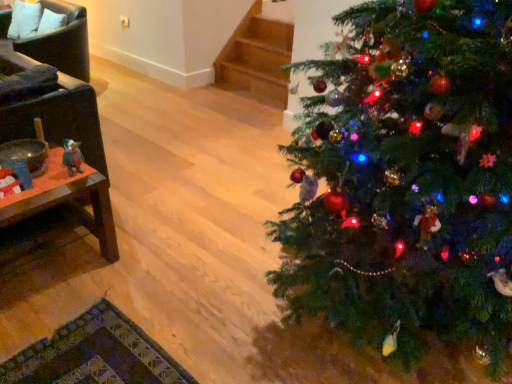
Identify the location of vacant area that is in front of green plush toy at left. (54, 195).